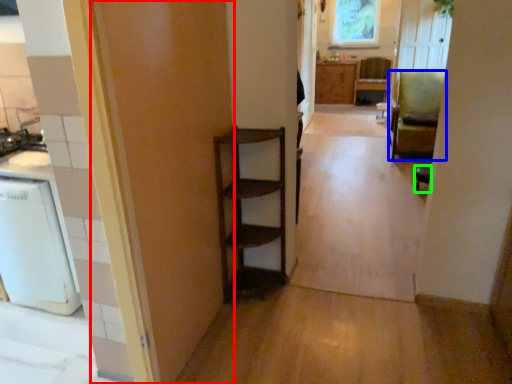
Question: Considering the real-world distances, which object is closest to door (highlighted by a red box)? chair (highlighted by a blue box) or chair (highlighted by a green box).

Choices:
 (A) chair
 (B) chair

Answer: (B)